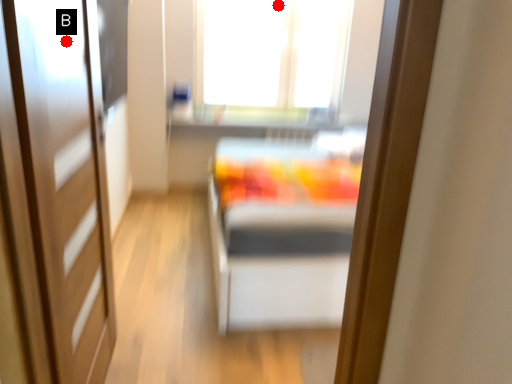
Question: Two points are circled on the image, labeled by A and B beside each circle. Which point appears closest to the camera in this image?

Choices:
 (A) A is closer
 (B) B is closer

Answer: (B)